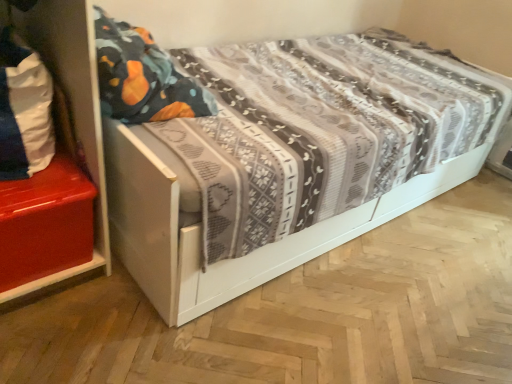
Question: Is white wood bed at center inside shiny red chest at left?

Choices:
 (A) no
 (B) yes

Answer: (A)

Question: Is shiny red chest at left not inside white wood bed at center?

Choices:
 (A) yes
 (B) no

Answer: (A)

Question: Is shiny red chest at left turned away from white wood bed at center?

Choices:
 (A) no
 (B) yes

Answer: (A)

Question: From a real-world perspective, is shiny red chest at left positioned under white wood bed at center based on gravity?

Choices:
 (A) no
 (B) yes

Answer: (B)

Question: From the image's perspective, would you say shiny red chest at left is shown under white wood bed at center?

Choices:
 (A) yes
 (B) no

Answer: (A)

Question: From the image's perspective, is shiny red chest at left above white wood bed at center?

Choices:
 (A) yes
 (B) no

Answer: (B)

Question: Does white fabric pillow at left have a larger size compared to shiny red chest at left?

Choices:
 (A) yes
 (B) no

Answer: (B)

Question: Can you confirm if white fabric pillow at left is thinner than shiny red chest at left?

Choices:
 (A) yes
 (B) no

Answer: (A)

Question: Is white fabric pillow at left at the left side of shiny red chest at left?

Choices:
 (A) no
 (B) yes

Answer: (A)

Question: Is white fabric pillow at left smaller than shiny red chest at left?

Choices:
 (A) yes
 (B) no

Answer: (A)

Question: Is white fabric pillow at left further to the viewer compared to shiny red chest at left?

Choices:
 (A) no
 (B) yes

Answer: (A)

Question: Are white fabric pillow at left and shiny red chest at left far apart?

Choices:
 (A) yes
 (B) no

Answer: (B)

Question: Considering the relative sizes of shiny red chest at left and white fabric pillow at left in the image provided, is shiny red chest at left thinner than white fabric pillow at left?

Choices:
 (A) yes
 (B) no

Answer: (B)